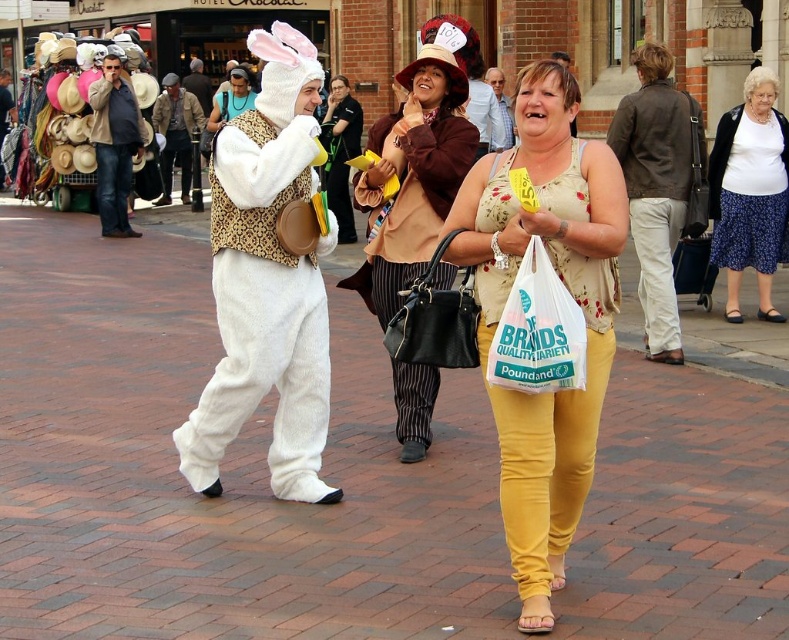
Question: Is brown leather jacket at upper right to the left of white plush costume at center from the viewer's perspective?

Choices:
 (A) yes
 (B) no

Answer: (B)

Question: Is white plush bunny at left to the right of brown leather jacket at upper right from the viewer's perspective?

Choices:
 (A) yes
 (B) no

Answer: (B)

Question: Does brick pavement at center have a larger size compared to brown leather jacket at upper right?

Choices:
 (A) yes
 (B) no

Answer: (A)

Question: Which is nearer to the white fur costume at center?

Choices:
 (A) striped fabric pants at center
 (B) matte brown purse at center
 (C) white plastic bag at center

Answer: (B)

Question: Which of the following is the closest to the observer?

Choices:
 (A) white plush bunny at left
 (B) striped fabric pants at center
 (C) white fur costume at center

Answer: (A)

Question: Among these objects, which one is farthest from the camera?

Choices:
 (A) floral tank top at center
 (B) white fur costume at center
 (C) light blue shirt at center
 (D) striped fabric pants at center

Answer: (B)